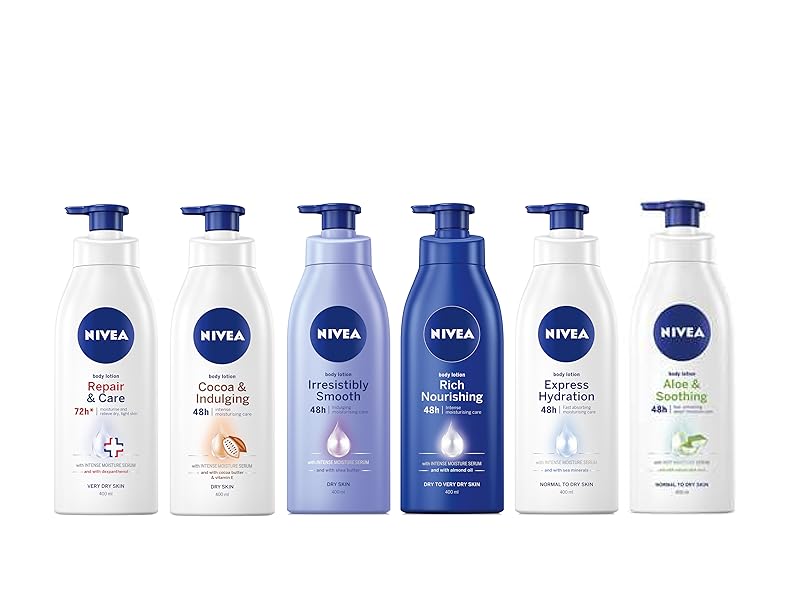
The image size is (800, 600). In order to click on lotion bottles in this screenshot , I will do `click(144, 380)`, `click(186, 371)`, `click(300, 369)`, `click(420, 374)`, `click(534, 364)`, `click(654, 371)`.